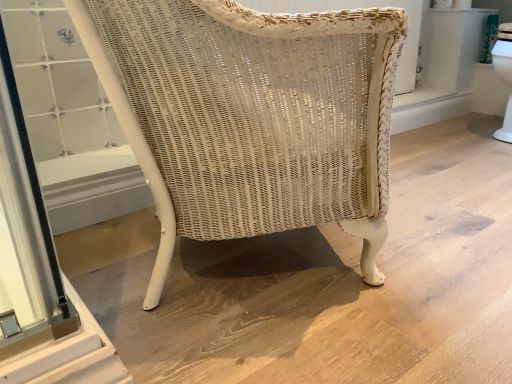
Question: Would you say metallic silver screen door at lower left is inside or outside white wicker chair at center?

Choices:
 (A) inside
 (B) outside

Answer: (B)

Question: Is metallic silver screen door at lower left wider or thinner than white wicker chair at center?

Choices:
 (A) wide
 (B) thin

Answer: (B)

Question: In terms of height, does metallic silver screen door at lower left look taller or shorter compared to white wicker chair at center?

Choices:
 (A) short
 (B) tall

Answer: (A)

Question: From the image's perspective, is white wicker chair at center located above or below metallic silver screen door at lower left?

Choices:
 (A) below
 (B) above

Answer: (B)

Question: Is white wicker chair at center wider or thinner than metallic silver screen door at lower left?

Choices:
 (A) wide
 (B) thin

Answer: (A)

Question: Considering the positions of point (147, 288) and point (35, 177), is point (147, 288) closer or farther from the camera than point (35, 177)?

Choices:
 (A) closer
 (B) farther

Answer: (B)

Question: Is white wicker chair at center in front of or behind metallic silver screen door at lower left in the image?

Choices:
 (A) front
 (B) behind

Answer: (A)